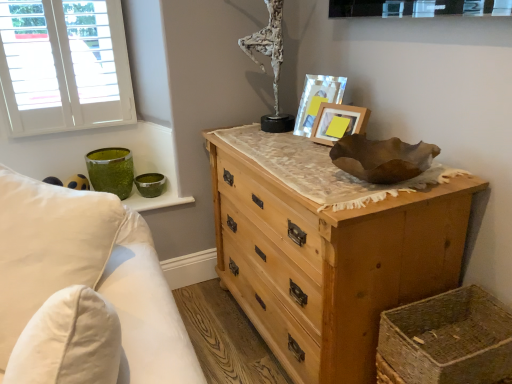
At what (x,y) coordinates should I click in order to perform the action: click on vacant space that is to the left of matte wooden picture frame at upper right, which is the second picture frame in front-to-back order. Please return your answer as a coordinate pair (x, y). The height and width of the screenshot is (384, 512). Looking at the image, I should click on (280, 125).